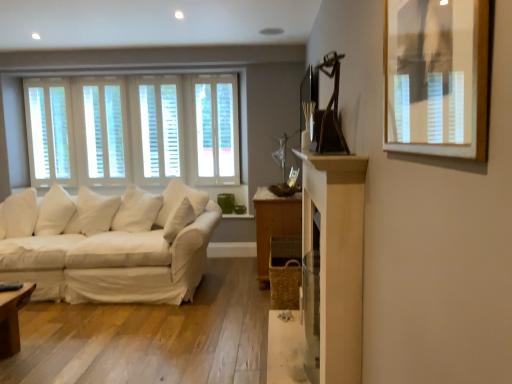
Question: Is wooden framed picture at upper right to the right of white wood window at center, which is the 2th window from left to right, from the viewer's perspective?

Choices:
 (A) no
 (B) yes

Answer: (B)

Question: From a real-world perspective, is wooden framed picture at upper right physically below white wood window at center, which is the 2th window from left to right?

Choices:
 (A) no
 (B) yes

Answer: (A)

Question: Is wooden framed picture at upper right smaller than white wood window at center, which is the 2th window from left to right?

Choices:
 (A) no
 (B) yes

Answer: (B)

Question: Is wooden framed picture at upper right to the left of white wood window at center, which is counted as the 1th window, starting from the right, from the viewer's perspective?

Choices:
 (A) yes
 (B) no

Answer: (B)

Question: Is the depth of wooden framed picture at upper right greater than that of white wood window at center, which is counted as the 1th window, starting from the right?

Choices:
 (A) no
 (B) yes

Answer: (A)

Question: Does wooden framed picture at upper right have a greater height compared to white wood window at center, which is the 2th window from left to right?

Choices:
 (A) no
 (B) yes

Answer: (A)

Question: Is wooden framed picture at upper right not within white wood blinds at left, arranged as the 2th window when viewed from the right?

Choices:
 (A) no
 (B) yes

Answer: (B)

Question: Is wooden framed picture at upper right in contact with white wood blinds at left, arranged as the 2th window when viewed from the right?

Choices:
 (A) yes
 (B) no

Answer: (B)

Question: From the image's perspective, is wooden framed picture at upper right located beneath white wood blinds at left, arranged as the 2th window when viewed from the right?

Choices:
 (A) yes
 (B) no

Answer: (A)

Question: Is wooden framed picture at upper right thinner than white wood blinds at left, the first window in the left-to-right sequence?

Choices:
 (A) yes
 (B) no

Answer: (B)

Question: Is wooden framed picture at upper right turned away from white wood blinds at left, arranged as the 2th window when viewed from the right?

Choices:
 (A) no
 (B) yes

Answer: (A)

Question: Is white wood blinds at left, the first window in the left-to-right sequence, located within wooden framed picture at upper right?

Choices:
 (A) no
 (B) yes

Answer: (A)

Question: Is white wood blinds at left, the first window in the left-to-right sequence, wider than white wood window at center, which is counted as the 1th window, starting from the right?

Choices:
 (A) no
 (B) yes

Answer: (A)